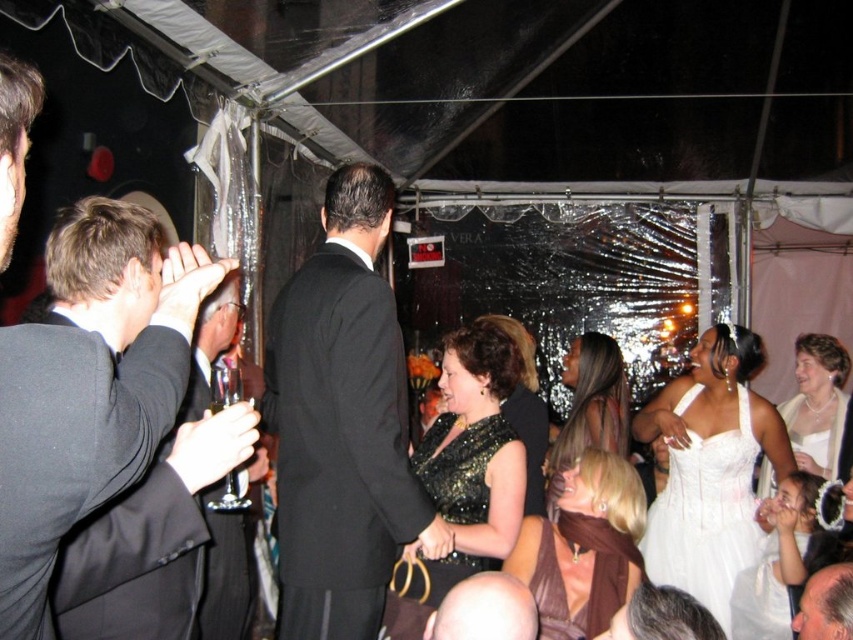
Which is more to the left, white satin dress at center or brown satin dress at center?

brown satin dress at center is more to the left.

Which is above, white satin dress at center or brown satin dress at center?

white satin dress at center

You are a GUI agent. You are given a task and a screenshot of the screen. Output one action in this format:
    pyautogui.click(x=<x>, y=<y>)
    Task: Click on the white satin dress at center
    Image resolution: width=853 pixels, height=640 pixels.
    Given the screenshot: What is the action you would take?
    [711, 468]

Is white satin dress at lower right positioned behind white satin dress at right?

No, it is in front of white satin dress at right.

Where is `white satin dress at lower right`? Image resolution: width=853 pixels, height=640 pixels. white satin dress at lower right is located at coordinates (776, 561).

Can you confirm if sequined black dress at center is taller than gray hair at center?

Yes.

Does sequined black dress at center appear over gray hair at center?

Yes.

This screenshot has height=640, width=853. Identify the location of sequined black dress at center. (473, 456).